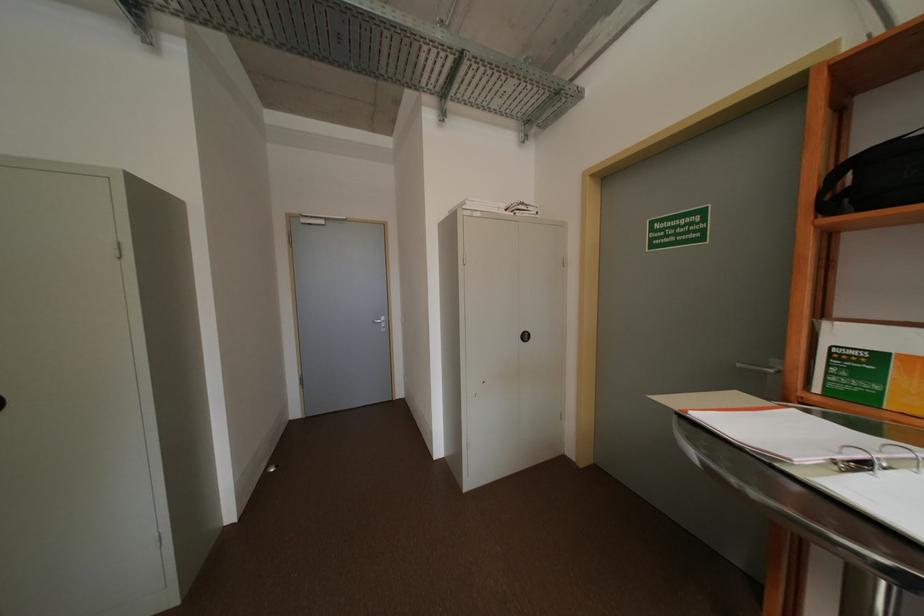
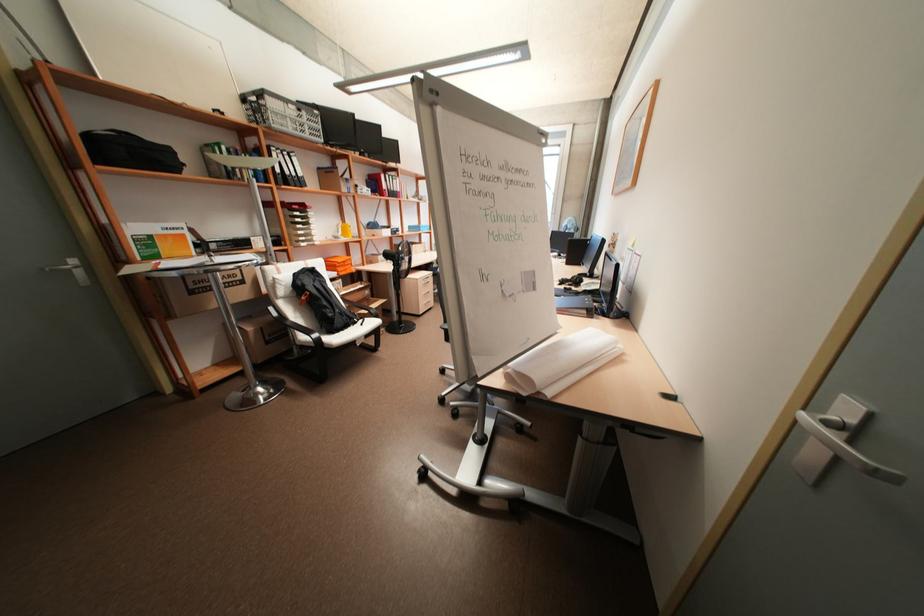
In the second image, find the point that corresponds to (x=885, y=355) in the first image.

(155, 236)